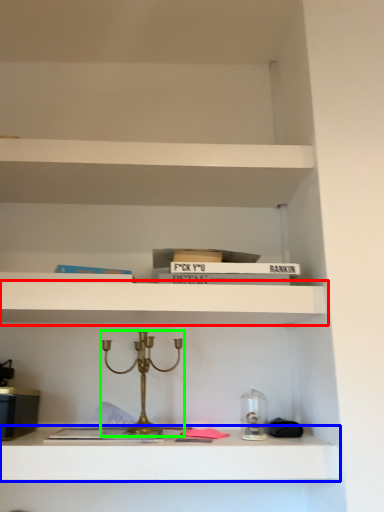
Question: Based on their relative distances, which object is nearer to shelf (highlighted by a red box)? Choose from shelf (highlighted by a blue box) and candle holder (highlighted by a green box).

Choices:
 (A) shelf
 (B) candle holder

Answer: (B)